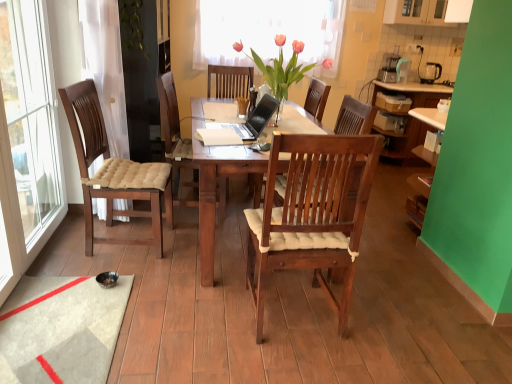
The image size is (512, 384). Describe the element at coordinates (256, 119) in the screenshot. I see `satin black laptop at center` at that location.

Measure the distance between satin black laptop at center and camera.

The distance of satin black laptop at center from camera is 2.30 meters.

What do you see at coordinates (131, 25) in the screenshot? I see `green leafy plant at upper left` at bounding box center [131, 25].

The height and width of the screenshot is (384, 512). What are the coordinates of `translucent fabric at upper center` in the screenshot? It's located at (268, 31).

From the image's perspective, is white plastic power outlet at upper right beneath pink matte vase at center?

No, from the image's perspective, white plastic power outlet at upper right is not beneath pink matte vase at center.

Locate an element on the screen. The width and height of the screenshot is (512, 384). flower located below the white plastic power outlet at upper right (from the image's perspective) is located at coordinates (279, 67).

Is white plastic power outlet at upper right thinner than pink matte vase at center?

Yes, white plastic power outlet at upper right is thinner than pink matte vase at center.

Is white plastic power outlet at upper right positioned with its back to pink matte vase at center?

No, pink matte vase at center is not at the back of white plastic power outlet at upper right.

Considering the sizes of translucent fabric at upper center and wooden chair at center in the image, is translucent fabric at upper center wider or thinner than wooden chair at center?

In the image, translucent fabric at upper center appears to be more narrow than wooden chair at center.

From the image's perspective, is translucent fabric at upper center positioned above or below wooden chair at center?

Based on their image positions, translucent fabric at upper center is located above wooden chair at center.

Do you think black plastic kettle at upper right is within wooden chair at center, or outside of it?

black plastic kettle at upper right is located beyond the bounds of wooden chair at center.

In the scene shown: Is black plastic kettle at upper right taller or shorter than wooden chair at center?

Considering their sizes, black plastic kettle at upper right has less height than wooden chair at center.

From the image's perspective, is black plastic kettle at upper right located above wooden chair at center?

Yes, from the image's perspective, black plastic kettle at upper right is over wooden chair at center.

Can you see black plastic kettle at upper right touching wooden chair at center?

No, black plastic kettle at upper right is not with wooden chair at center.

Is wooden chair at center surrounded by pink matte vase at center?

No, wooden chair at center is located outside of pink matte vase at center.

Is pink matte vase at center positioned before wooden chair at center?

Yes, pink matte vase at center is closer to the viewer.

How many degrees apart are the facing directions of pink matte vase at center and wooden chair at center?

95.1 degrees.

Is translucent fabric at upper center bigger or smaller than pink matte vase at center?

translucent fabric at upper center is smaller than pink matte vase at center.

From the image's perspective, which one is positioned lower, translucent fabric at upper center or pink matte vase at center?

pink matte vase at center is shown below in the image.

Considering the relative positions of translucent fabric at upper center and pink matte vase at center in the image provided, is translucent fabric at upper center to the left of pink matte vase at center from the viewer's perspective?

No.

Is translucent fabric at upper center next to pink matte vase at center and touching it?

There is a gap between translucent fabric at upper center and pink matte vase at center.

Is point (437, 74) farther from camera compared to point (282, 80)?

That is True.

Who is taller, black plastic kettle at upper right or pink matte vase at center?

Standing taller between the two is pink matte vase at center.

Between black plastic kettle at upper right and pink matte vase at center, which one has smaller width?

Thinner between the two is black plastic kettle at upper right.

Does black plastic kettle at upper right appear on the right side of pink matte vase at center?

Indeed, black plastic kettle at upper right is positioned on the right side of pink matte vase at center.

Which object is further away from the camera taking this photo, satin black laptop at center or pink matte vase at center?

pink matte vase at center is more distant.

Does satin black laptop at center have a lesser width compared to pink matte vase at center?

Yes, satin black laptop at center is thinner than pink matte vase at center.

Which is less distant, (267, 105) or (300, 43)?

The point (267, 105) is more forward.

Would you consider satin black laptop at center to be distant from pink matte vase at center?

No, there isn't a large distance between satin black laptop at center and pink matte vase at center.

Find the location of `power outlet behind the pink matte vase at center`. power outlet behind the pink matte vase at center is located at coordinates (420, 48).

This screenshot has height=384, width=512. Identify the location of armchair that appears on the left of translucent fabric at upper center. point(230,81).

Considering their positions, is green leafy plant at upper left positioned further to pink matte vase at center than black plastic kettle at upper right?

Based on the image, black plastic kettle at upper right appears to be further to pink matte vase at center.

Consider the image. Looking at the image, which one is located closer to white plastic power outlet at upper right, wooden chair at center or pink matte vase at center?

wooden chair at center lies closer to white plastic power outlet at upper right than the other object.

In the scene shown: Which object lies nearer to the anchor point green leafy plant at upper left, black plastic kettle at upper right or white plastic power outlet at upper right?

Based on the image, white plastic power outlet at upper right appears to be nearer to green leafy plant at upper left.

Considering their positions, is wooden chair at center positioned closer to pink matte vase at center than white plastic power outlet at upper right?

wooden chair at center.

In the scene shown: Which object lies further to the anchor point black plastic kettle at upper right, translucent fabric at upper center or satin black laptop at center?

Among the two, satin black laptop at center is located further to black plastic kettle at upper right.

From the image, which object appears to be nearer to satin black laptop at center, black plastic kettle at upper right or translucent fabric at upper center?

translucent fabric at upper center is closer to satin black laptop at center.

Estimate the real-world distances between objects in this image. Which object is closer to pink matte vase at center, translucent fabric at upper center or black plastic kettle at upper right?

Among the two, translucent fabric at upper center is located nearer to pink matte vase at center.

Estimate the real-world distances between objects in this image. Which object is closer to green leafy plant at upper left, wooden chair at center or translucent fabric at upper center?

wooden chair at center.

What are the coordinates of `window screen between wooden chair at center and black plastic kettle at upper right from left to right` in the screenshot? It's located at (268, 31).

Find the location of a particular element. This screenshot has height=384, width=512. armchair between satin black laptop at center and white plastic power outlet at upper right along the z-axis is located at coordinates (230, 81).

The width and height of the screenshot is (512, 384). Identify the location of plant between pink matte vase at center and translucent fabric at upper center from front to back. (131, 25).

Where is `laptop between green leafy plant at upper left and white plastic power outlet at upper right in the horizontal direction`? laptop between green leafy plant at upper left and white plastic power outlet at upper right in the horizontal direction is located at coordinates (256, 119).